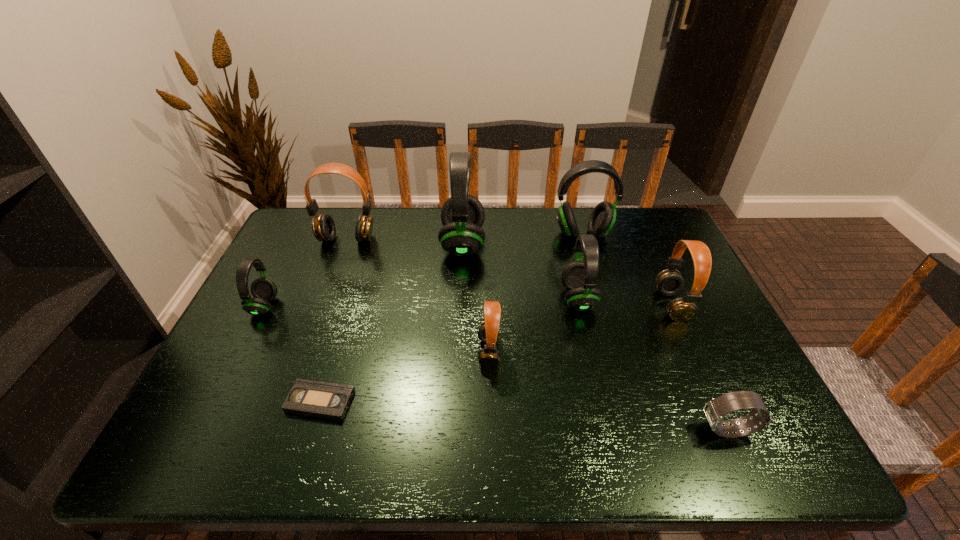
The image size is (960, 540). Find the location of `free location located on the front of the videotape`. free location located on the front of the videotape is located at coordinates (307, 443).

Locate an element on the screen. This screenshot has height=540, width=960. object present at the near edge is located at coordinates (715, 410).

Find the location of `headset that is at the right edge`. headset that is at the right edge is located at coordinates pos(669,282).

This screenshot has height=540, width=960. I want to click on watch positioned at the right edge, so click(x=715, y=410).

Image resolution: width=960 pixels, height=540 pixels. I want to click on object at the far left corner, so click(323, 226).

Where is `object at the near right corner`? This screenshot has width=960, height=540. object at the near right corner is located at coordinates (715, 410).

Find the location of a particular element. The width and height of the screenshot is (960, 540). vacant space at the far edge is located at coordinates (544, 227).

You are a GUI agent. You are given a task and a screenshot of the screen. Output one action in this format:
    pyautogui.click(x=<x>, y=<y>)
    Task: Click on the vacant space at the near edge of the desktop
    This screenshot has height=540, width=960.
    Given the screenshot: What is the action you would take?
    pyautogui.click(x=663, y=450)

Image resolution: width=960 pixels, height=540 pixels. In order to click on free space at the left edge in this screenshot , I will do `click(206, 421)`.

Identify the location of blank area at the right edge. The image size is (960, 540). (701, 421).